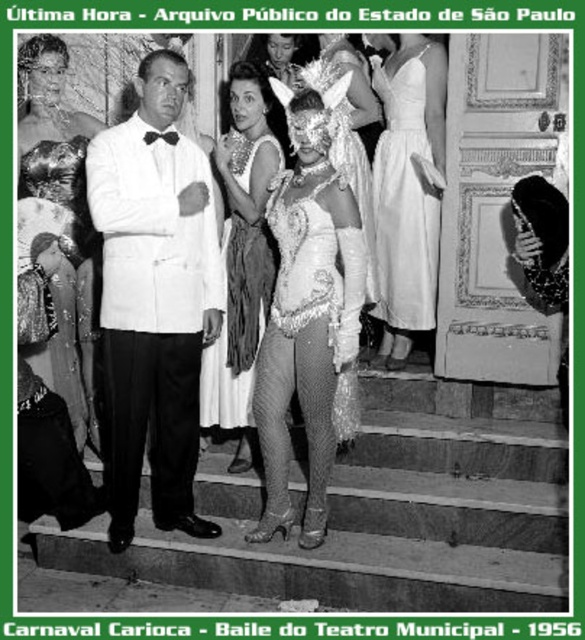
Does white satin suit at center have a lesser height compared to white satin dress at upper right?

No, white satin suit at center is not shorter than white satin dress at upper right.

Can you confirm if white satin suit at center is positioned to the right of white satin dress at upper right?

Incorrect, white satin suit at center is not on the right side of white satin dress at upper right.

Which is in front, point (187, 320) or point (380, 189)?

Positioned in front is point (187, 320).

Find the location of a particular element. white satin suit at center is located at coordinates (153, 298).

How far apart are smooth stone stairs at center and white satin suit at center?

The distance of smooth stone stairs at center from white satin suit at center is 34.19 inches.

What do you see at coordinates (381, 515) in the screenshot?
I see `smooth stone stairs at center` at bounding box center [381, 515].

The image size is (585, 640). I want to click on smooth stone stairs at center, so click(x=381, y=515).

From the picture: Can you confirm if white satin suit at center is thinner than shiny silver dress at center?

In fact, white satin suit at center might be wider than shiny silver dress at center.

Can you confirm if white satin suit at center is taller than shiny silver dress at center?

Yes, white satin suit at center is taller than shiny silver dress at center.

Does point (184, 273) come closer to viewer compared to point (211, 346)?

Yes, it is in front of point (211, 346).

Where is `white satin suit at center`? The width and height of the screenshot is (585, 640). white satin suit at center is located at coordinates (153, 298).